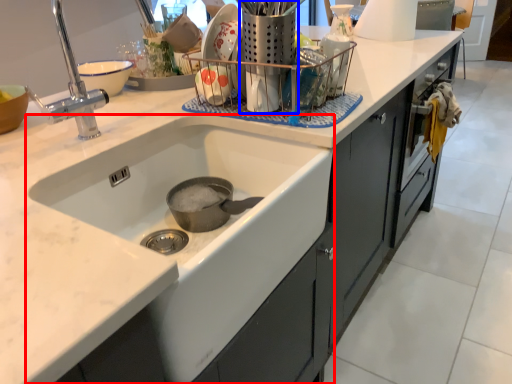
Question: Which point is closer to the camera, sink (highlighted by a red box) or appliance (highlighted by a blue box)?

Choices:
 (A) sink
 (B) appliance

Answer: (A)